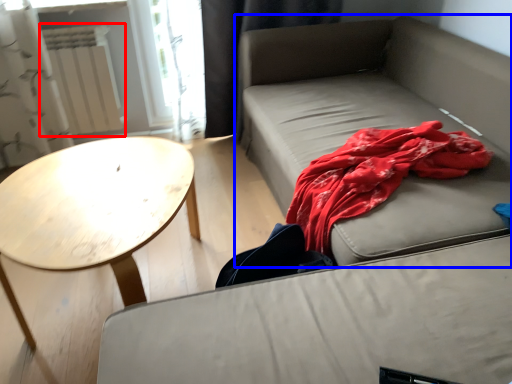
Question: Which point is closer to the camera, radiator (highlighted by a red box) or studio couch (highlighted by a blue box)?

Choices:
 (A) radiator
 (B) studio couch

Answer: (B)